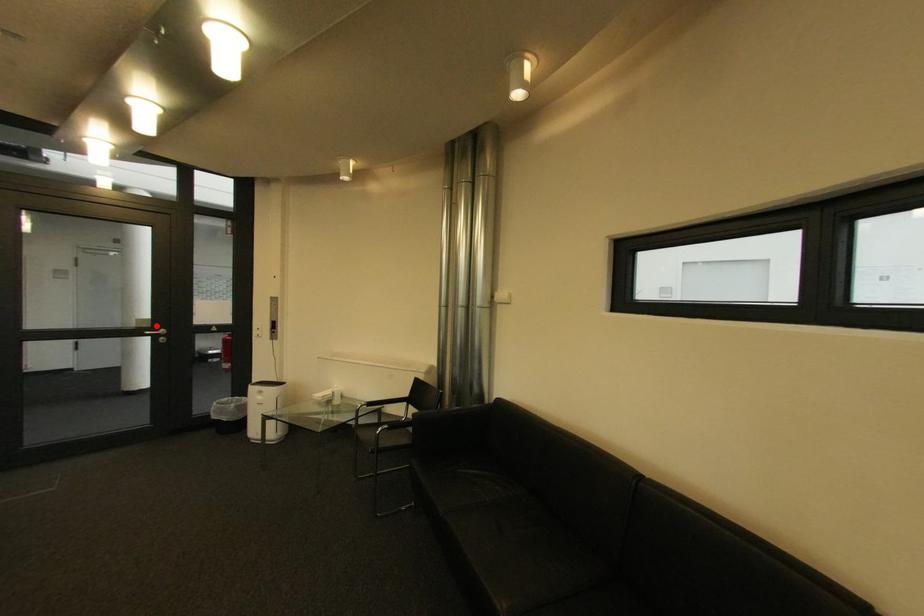
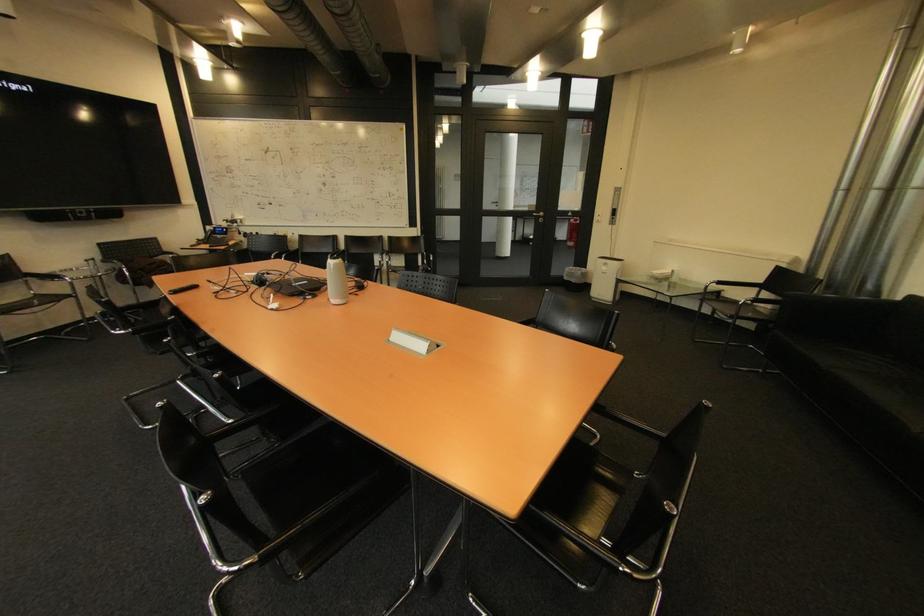
Question: I am providing you with two images of the same scene from different viewpoints. A red point is shown in image1. For the corresponding object point in image2, is it positioned nearer or farther from the camera?

Choices:
 (A) Nearer
 (B) Farther

Answer: (A)